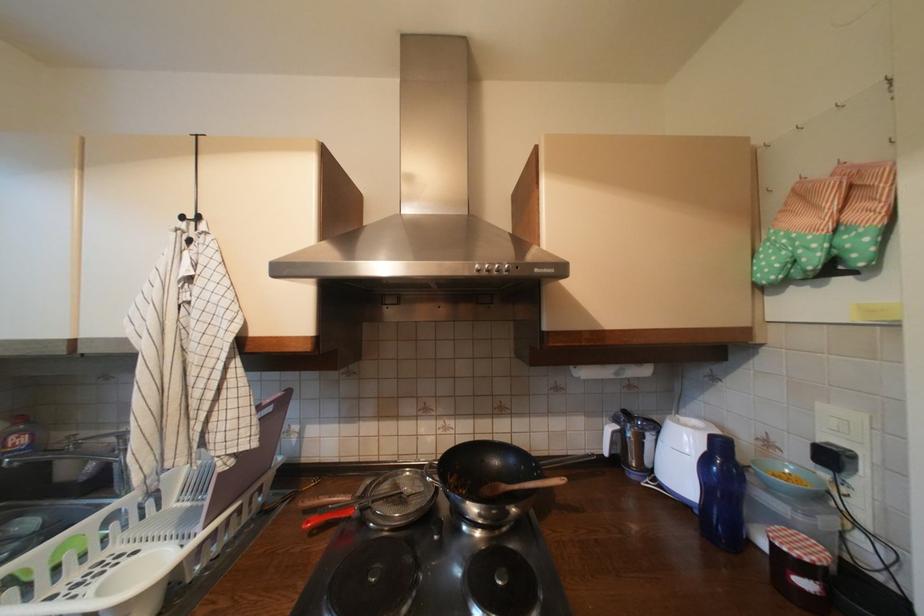
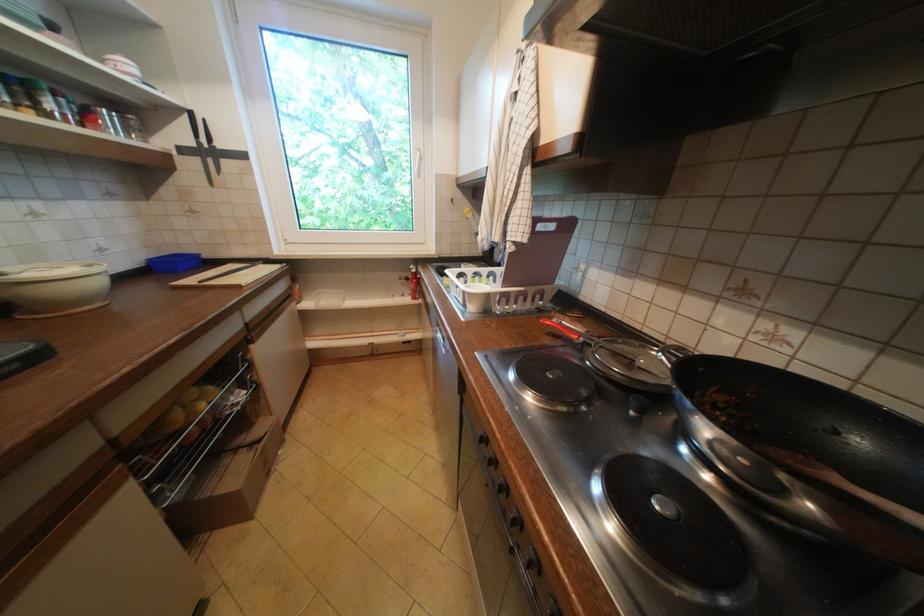
Locate, in the second image, the point that corresponds to point 322,533 in the first image.

(558, 334)